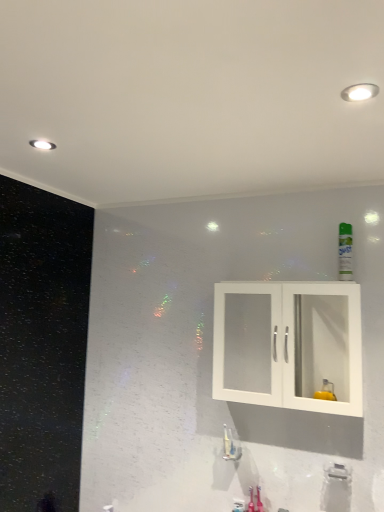
What do you see at coordinates (337, 472) in the screenshot?
I see `white plastic faucet at lower center, acting as the 2th plumbing fixture starting from the top` at bounding box center [337, 472].

This screenshot has width=384, height=512. I want to click on green matte mouthwash at upper right, so click(345, 252).

From the image's perspective, between white glossy faucet at lower center, marked as the 2th plumbing fixture in a right-to-left arrangement, and white matte cabinet at center, which one is located above?

From the image's view, white matte cabinet at center is above.

In the scene shown: Is white glossy faucet at lower center, the second plumbing fixture ordered from the bottom, with white matte cabinet at center?

white glossy faucet at lower center, the second plumbing fixture ordered from the bottom, and white matte cabinet at center are not in contact.

Does white glossy faucet at lower center, the 1th plumbing fixture from the left, have a greater width compared to green matte mouthwash at upper right?

No.

Can you confirm if white glossy faucet at lower center, which ranks as the 1th plumbing fixture in back-to-front order, is bigger than green matte mouthwash at upper right?

Actually, white glossy faucet at lower center, which ranks as the 1th plumbing fixture in back-to-front order, might be smaller than green matte mouthwash at upper right.

From a real-world perspective, between white glossy faucet at lower center, which ranks as the 1th plumbing fixture in back-to-front order, and green matte mouthwash at upper right, who is vertically higher?

In real-world perspective, green matte mouthwash at upper right is above.

Which is more to the right, white glossy faucet at lower center, the 1th plumbing fixture from the left, or green matte mouthwash at upper right?

green matte mouthwash at upper right is more to the right.

Is white matte cabinet at center spatially inside green matte mouthwash at upper right, or outside of it?

The correct answer is: outside.

Looking at the image, does white matte cabinet at center seem bigger or smaller compared to green matte mouthwash at upper right?

Clearly, white matte cabinet at center is larger in size than green matte mouthwash at upper right.

From the image's perspective, relative to green matte mouthwash at upper right, is white matte cabinet at center above or below?

From the image's perspective, white matte cabinet at center appears below green matte mouthwash at upper right.

Locate an element on the screen. The image size is (384, 512). cabinetry that is above the white glossy faucet at lower center, placed as the second plumbing fixture when sorted from front to back (from a real-world perspective) is located at coordinates (288, 344).

Is white matte cabinet at center wider than white glossy faucet at lower center, placed as the second plumbing fixture when sorted from front to back?

Indeed, white matte cabinet at center has a greater width compared to white glossy faucet at lower center, placed as the second plumbing fixture when sorted from front to back.

How many degrees apart are the facing directions of white matte cabinet at center and white glossy faucet at lower center, the 1th plumbing fixture viewed from the top?

The angular difference between white matte cabinet at center and white glossy faucet at lower center, the 1th plumbing fixture viewed from the top, is 0.237 degrees.

Does white matte cabinet at center turn towards white glossy faucet at lower center, the second plumbing fixture ordered from the bottom?

No.

Could you measure the distance between white plastic faucet at lower center, acting as the 2th plumbing fixture starting from the top, and white matte cabinet at center?

white plastic faucet at lower center, acting as the 2th plumbing fixture starting from the top, is 60.32 centimeters from white matte cabinet at center.

Which is more to the left, white plastic faucet at lower center, which is counted as the second plumbing fixture, starting from the left, or white matte cabinet at center?

white matte cabinet at center is more to the left.

In the scene shown: Considering the relative sizes of white plastic faucet at lower center, marked as the second plumbing fixture in a back-to-front arrangement, and white matte cabinet at center in the image provided, is white plastic faucet at lower center, marked as the second plumbing fixture in a back-to-front arrangement, thinner than white matte cabinet at center?

Indeed, white plastic faucet at lower center, marked as the second plumbing fixture in a back-to-front arrangement, has a lesser width compared to white matte cabinet at center.

Is the depth of white plastic faucet at lower center, marked as the second plumbing fixture in a back-to-front arrangement, less than that of white matte cabinet at center?

No.

From a real-world perspective, is green matte mouthwash at upper right above or below white matte cabinet at center?

Clearly, from a real-world perspective, green matte mouthwash at upper right is above white matte cabinet at center.

Is white matte cabinet at center a part of green matte mouthwash at upper right?

Definitely not — white matte cabinet at center is not inside green matte mouthwash at upper right.

From the image's perspective, is green matte mouthwash at upper right above or below white matte cabinet at center?

Clearly, from the image's perspective, green matte mouthwash at upper right is above white matte cabinet at center.

Which of these two, green matte mouthwash at upper right or white matte cabinet at center, stands shorter?

With less height is green matte mouthwash at upper right.

How far apart are white matte cabinet at center and white plastic faucet at lower center, which is counted as the first plumbing fixture, starting from the right?

white matte cabinet at center and white plastic faucet at lower center, which is counted as the first plumbing fixture, starting from the right, are 60.32 centimeters apart from each other.

Is white matte cabinet at center positioned far away from white plastic faucet at lower center, which is the first plumbing fixture from front to back?

No, there isn't a large distance between white matte cabinet at center and white plastic faucet at lower center, which is the first plumbing fixture from front to back.

Is white matte cabinet at center positioned beyond the bounds of white plastic faucet at lower center, which is counted as the second plumbing fixture, starting from the left?

white matte cabinet at center is positioned outside white plastic faucet at lower center, which is counted as the second plumbing fixture, starting from the left.

The width and height of the screenshot is (384, 512). What are the coordinates of `cabinetry above the white plastic faucet at lower center, marked as the second plumbing fixture in a back-to-front arrangement (from the image's perspective)` in the screenshot? It's located at (288, 344).

From the image's perspective, count 1st plumbing fixtures downward from the white matte cabinet at center and point to it. Please provide its 2D coordinates.

[(231, 445)]

The width and height of the screenshot is (384, 512). Identify the location of the 2nd plumbing fixture to the left when counting from the green matte mouthwash at upper right. (231, 445).

Considering their positions, is white matte cabinet at center positioned further to white plastic faucet at lower center, marked as the second plumbing fixture in a back-to-front arrangement, than green matte mouthwash at upper right?

green matte mouthwash at upper right lies further to white plastic faucet at lower center, marked as the second plumbing fixture in a back-to-front arrangement, than the other object.

Based on their spatial positions, is green matte mouthwash at upper right or white glossy faucet at lower center, placed as the second plumbing fixture when sorted from front to back, closer to white plastic faucet at lower center, marked as the second plumbing fixture in a back-to-front arrangement?

white glossy faucet at lower center, placed as the second plumbing fixture when sorted from front to back, is positioned closer to the anchor white plastic faucet at lower center, marked as the second plumbing fixture in a back-to-front arrangement.

Considering their positions, is green matte mouthwash at upper right positioned further to white glossy faucet at lower center, which ranks as the 1th plumbing fixture in back-to-front order, than white matte cabinet at center?

Among the two, green matte mouthwash at upper right is located further to white glossy faucet at lower center, which ranks as the 1th plumbing fixture in back-to-front order.

Based on their spatial positions, is white glossy faucet at lower center, the 1th plumbing fixture viewed from the top, or white plastic faucet at lower center, marked as the second plumbing fixture in a back-to-front arrangement, closer to green matte mouthwash at upper right?

white plastic faucet at lower center, marked as the second plumbing fixture in a back-to-front arrangement, is closer to green matte mouthwash at upper right.

When comparing their distances from white plastic faucet at lower center, which is the 1th plumbing fixture in bottom-to-top order, does white glossy faucet at lower center, the second plumbing fixture ordered from the bottom, or green matte mouthwash at upper right seem further?

Among the two, green matte mouthwash at upper right is located further to white plastic faucet at lower center, which is the 1th plumbing fixture in bottom-to-top order.

Based on their spatial positions, is white plastic faucet at lower center, which is counted as the second plumbing fixture, starting from the left, or white matte cabinet at center closer to green matte mouthwash at upper right?

Based on the image, white matte cabinet at center appears to be nearer to green matte mouthwash at upper right.

Which object lies nearer to the anchor point white plastic faucet at lower center, which is counted as the second plumbing fixture, starting from the left, white matte cabinet at center or white glossy faucet at lower center, which ranks as the 1th plumbing fixture in back-to-front order?

The object closer to white plastic faucet at lower center, which is counted as the second plumbing fixture, starting from the left, is white glossy faucet at lower center, which ranks as the 1th plumbing fixture in back-to-front order.

When comparing their distances from green matte mouthwash at upper right, does white matte cabinet at center or white plastic faucet at lower center, acting as the 2th plumbing fixture starting from the top, seem further?

The object further to green matte mouthwash at upper right is white plastic faucet at lower center, acting as the 2th plumbing fixture starting from the top.

The width and height of the screenshot is (384, 512). I want to click on cabinetry between green matte mouthwash at upper right and white plastic faucet at lower center, which is counted as the first plumbing fixture, starting from the right, vertically, so click(288, 344).

Image resolution: width=384 pixels, height=512 pixels. I want to click on cabinetry between green matte mouthwash at upper right and white glossy faucet at lower center, the 1th plumbing fixture from the left, from top to bottom, so click(288, 344).

The image size is (384, 512). What are the coordinates of `plumbing fixture between white matte cabinet at center and white plastic faucet at lower center, which is the 1th plumbing fixture in bottom-to-top order, in the up-down direction` in the screenshot? It's located at point(231,445).

The image size is (384, 512). What are the coordinates of `plumbing fixture between green matte mouthwash at upper right and white plastic faucet at lower center, which is counted as the second plumbing fixture, starting from the left, from top to bottom` in the screenshot? It's located at (231, 445).